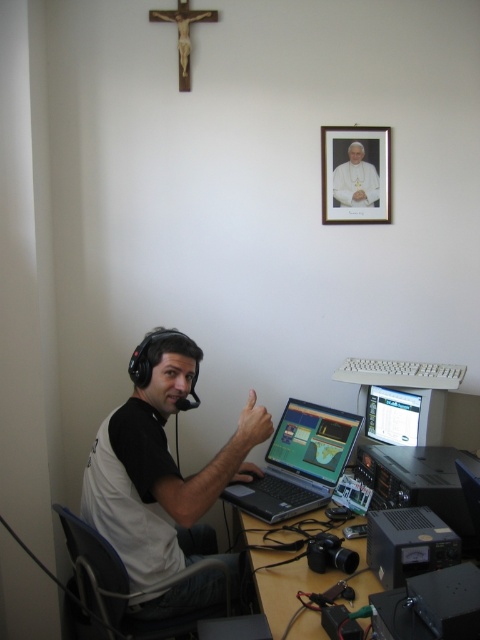
Between point (244, 497) and point (411, 388), which one is positioned behind?

The point (411, 388) is behind.

Measure the distance from silver/black laptop at center to matte black monitor at center.

The distance of silver/black laptop at center from matte black monitor at center is 9.92 inches.

Is point (296, 426) farther from camera compared to point (381, 396)?

Yes, point (296, 426) is farther from viewer.

Locate an element on the screen. The image size is (480, 640). silver/black laptop at center is located at coordinates (299, 461).

Is white paper portrait at upper center to the left of matte black monitor at center from the viewer's perspective?

Correct, you'll find white paper portrait at upper center to the left of matte black monitor at center.

Does white paper portrait at upper center have a smaller size compared to matte black monitor at center?

Yes.

Who is more forward, [371,138] or [364,410]?

Point [364,410]

Identify the location of white paper portrait at upper center. (356, 173).

Between silver/black laptop at center and black plastic computer desk at lower center, which one has more height?

Standing taller between the two is silver/black laptop at center.

Between silver/black laptop at center and black plastic computer desk at lower center, which one has less height?

black plastic computer desk at lower center is shorter.

The width and height of the screenshot is (480, 640). Find the location of `silver/black laptop at center`. silver/black laptop at center is located at coordinates (299, 461).